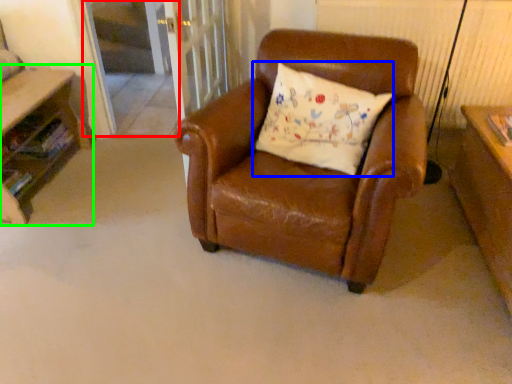
Question: Estimate the real-world distances between objects in this image. Which object is farther from screen door (highlighted by a red box), pillow (highlighted by a blue box) or table (highlighted by a green box)?

Choices:
 (A) pillow
 (B) table

Answer: (A)